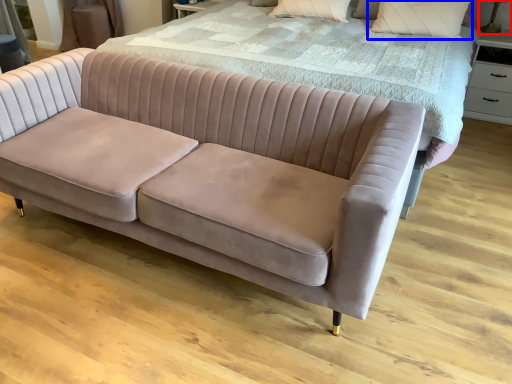
Question: Which point is further to the camera, table lamp (highlighted by a red box) or pillow (highlighted by a blue box)?

Choices:
 (A) table lamp
 (B) pillow

Answer: (A)